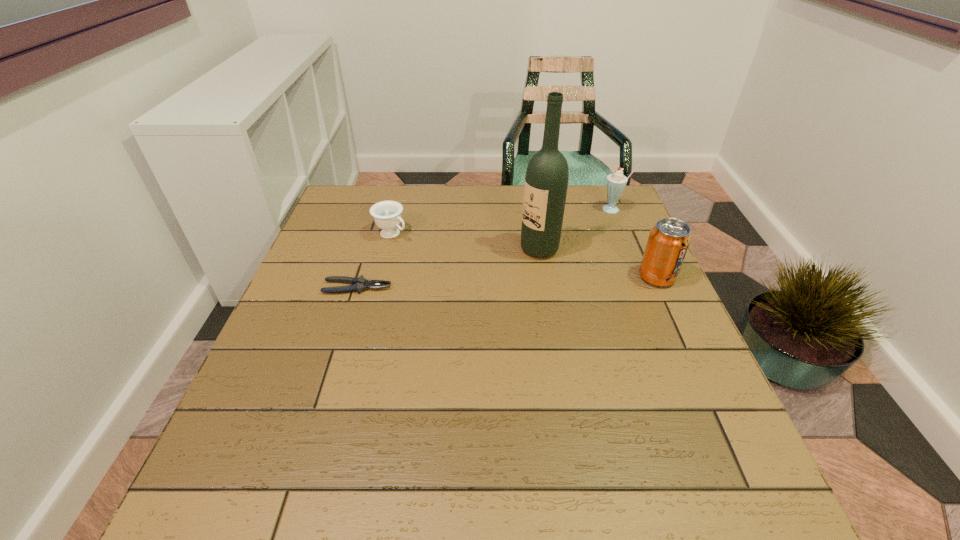
The image size is (960, 540). What are the coordinates of `pliers` in the screenshot? It's located at (359, 284).

Identify the location of soda can. (668, 241).

Locate an element on the screen. milkshake is located at coordinates (615, 183).

Identify the location of the fourth tallest object. (387, 214).

You are a GUI agent. You are given a task and a screenshot of the screen. Output one action in this format:
    pyautogui.click(x=<x>, y=<y>)
    Task: Click on the third object from right to left
    
    Given the screenshot: What is the action you would take?
    pyautogui.click(x=546, y=181)

Locate an element on the screen. The image size is (960, 540). the tallest object is located at coordinates (546, 181).

Locate an element on the screen. This screenshot has height=540, width=960. free space located at the gripping part of the pliers is located at coordinates coord(436,288).

In order to click on vacant space located 0.300m on the back of the soda can in this screenshot , I will do `click(623, 204)`.

In order to click on vacant area situated on the straw side of the milkshake in this screenshot , I will do `click(572, 249)`.

Image resolution: width=960 pixels, height=540 pixels. In order to click on free region located on the straw side of the milkshake in this screenshot , I will do [x=576, y=245].